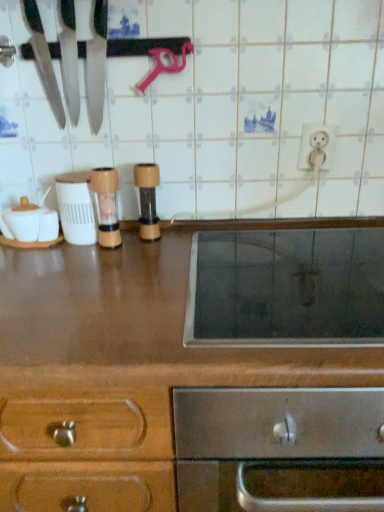
Image resolution: width=384 pixels, height=512 pixels. In order to click on free region on the left part of brown wood pepper grinder at center, the first appliance when ordered from right to left in this screenshot , I will do `click(84, 251)`.